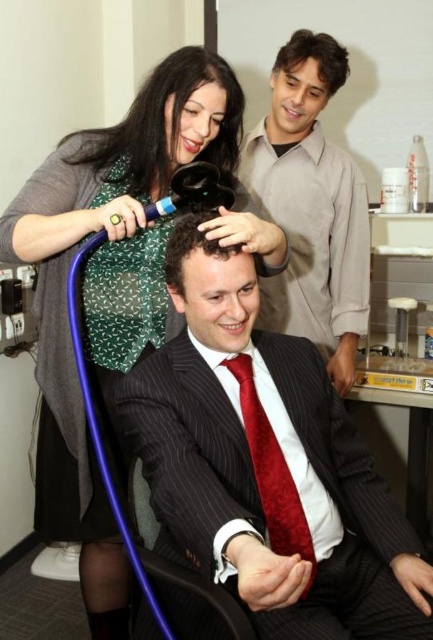
You are a photographer positioned at the camera. You notice two points in the scene, point (x=323, y=337) and point (x=74, y=156). Which point is closer to your camera?

Point (x=323, y=337) is further to the camera than point (x=74, y=156), so the closer point to your camera is point (x=74, y=156).

You are a photographer taking a portrait and want to ensure the smooth beige shirt at upper right and the shiny brown hair at upper right are both visible in the frame. Based on their positions, which object should you focus on first to capture both effectively?

The shiny brown hair at upper right is above the smooth beige shirt at upper right, so focusing on the shiny brown hair at upper right first would allow you to adjust the frame to include both objects.